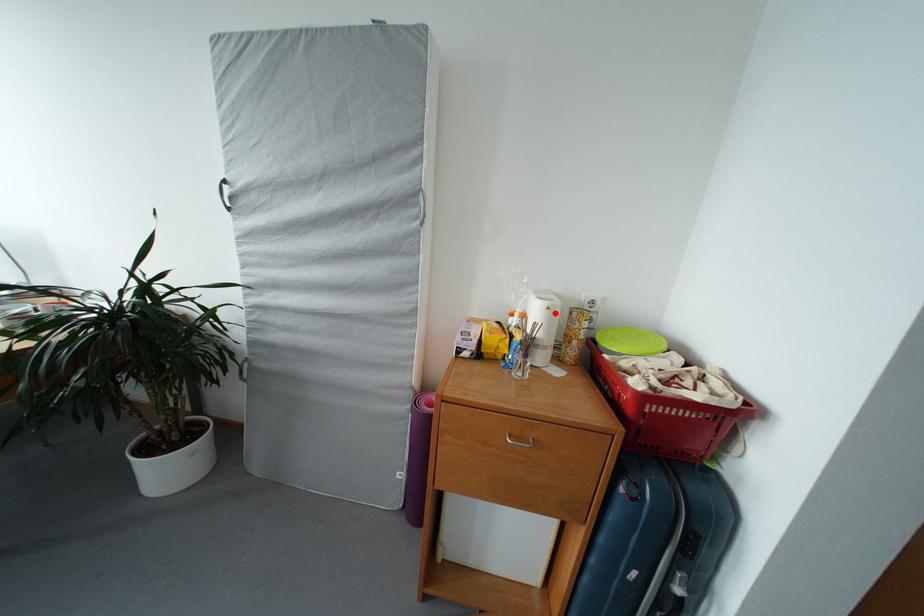
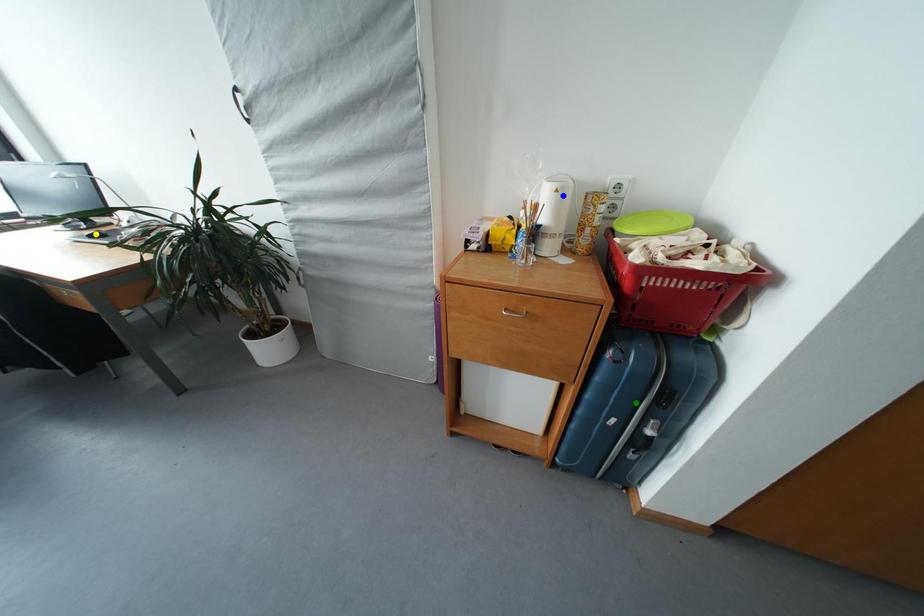
Question: I am providing you with two images of the same scene from different viewpoints. A red point is marked on the first image. You are given multiple points on the second image. Can you choose the point in image 2 that corresponds to the point in image 1?

Choices:
 (A) green point
 (B) yellow point
 (C) blue point

Answer: (C)